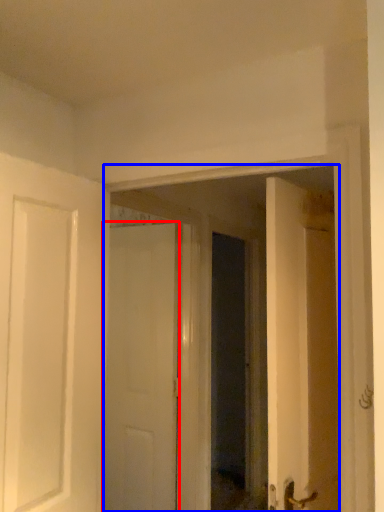
Question: Which point is closer to the camera, door (highlighted by a red box) or glass door (highlighted by a blue box)?

Choices:
 (A) door
 (B) glass door

Answer: (B)